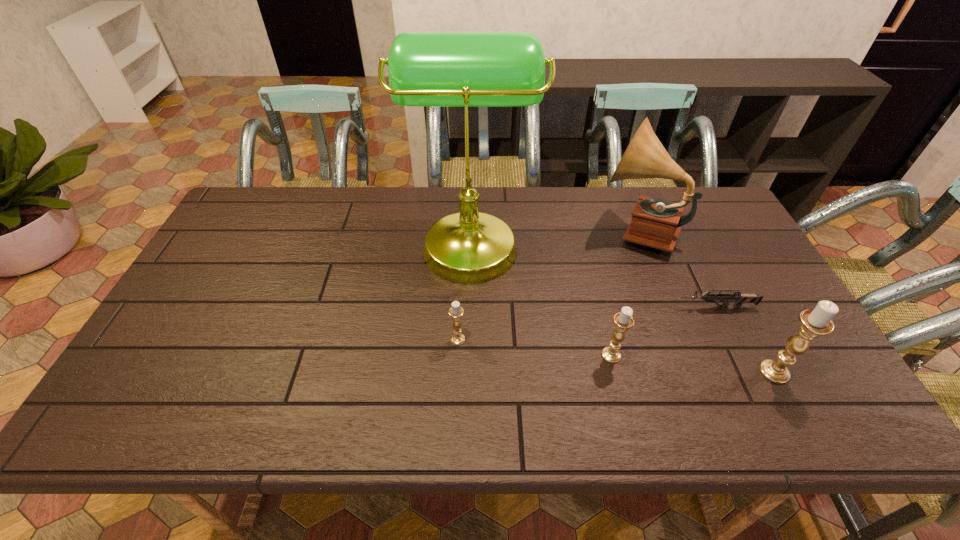
Where is `vacant space situated on the back of the shortest candle holder`? This screenshot has width=960, height=540. vacant space situated on the back of the shortest candle holder is located at coordinates (460, 290).

Image resolution: width=960 pixels, height=540 pixels. In order to click on vacant space situated on the left of the second shortest candle holder in this screenshot , I will do `click(442, 355)`.

This screenshot has height=540, width=960. Find the location of `free space located 0.280m on the left of the rightmost candle holder`. free space located 0.280m on the left of the rightmost candle holder is located at coordinates (642, 372).

What are the coordinates of `vacant space located 0.150m on the desk next to the tallest object` in the screenshot? It's located at (586, 241).

Where is `vacant point located on the horn of the phonograph record`? The image size is (960, 540). vacant point located on the horn of the phonograph record is located at coordinates click(x=516, y=230).

Where is `free space located 0.400m on the horn of the phonograph record`? free space located 0.400m on the horn of the phonograph record is located at coordinates (471, 230).

Find the location of a particular element. blank area located 0.250m on the horn of the phonograph record is located at coordinates (518, 230).

The height and width of the screenshot is (540, 960). Identify the location of vacant space located 0.100m aimed along the barrel of the gun. (640, 307).

In order to click on vacant space located aimed along the barrel of the gun in this screenshot , I will do 600,307.

The width and height of the screenshot is (960, 540). Identify the location of vacant space situated 0.100m aimed along the barrel of the gun. (640, 307).